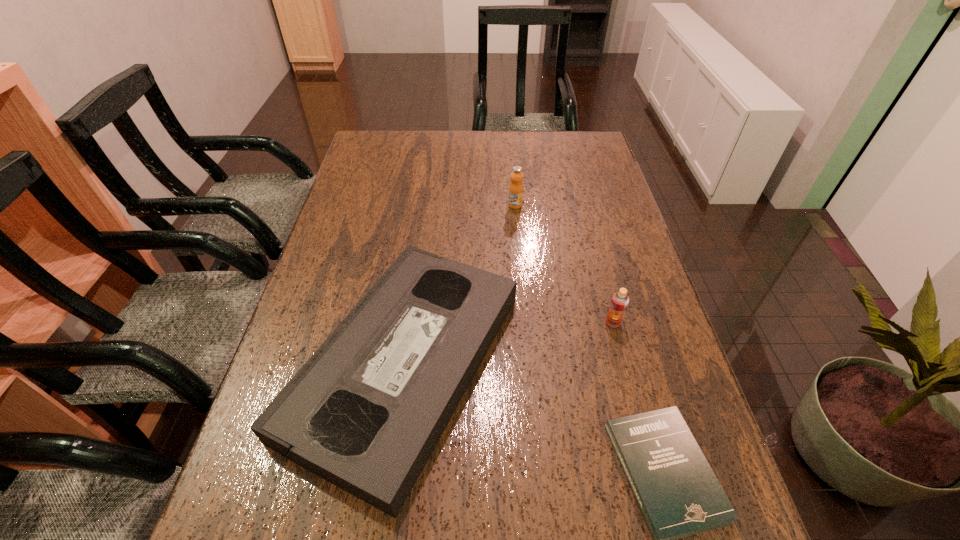
Image resolution: width=960 pixels, height=540 pixels. Find the location of `free space at the far edge`. free space at the far edge is located at coordinates (443, 152).

The height and width of the screenshot is (540, 960). What are the coordinates of `free space at the left edge of the desktop` in the screenshot? It's located at (258, 520).

The image size is (960, 540). I want to click on vacant region at the right edge of the desktop, so click(x=602, y=350).

The image size is (960, 540). Identify the location of vacant space at the far left corner of the desktop. (367, 140).

You are a GUI agent. You are given a task and a screenshot of the screen. Output one action in this format:
    pyautogui.click(x=<x>, y=<y>)
    Task: Click on the vacant point located between the videotape and the nearer orange juice
    
    Given the screenshot: What is the action you would take?
    pyautogui.click(x=509, y=343)

The image size is (960, 540). I want to click on unoccupied area between the right orange juice and the left orange juice, so [x=564, y=264].

Where is `free space between the right orange juice and the second shortest object`? free space between the right orange juice and the second shortest object is located at coordinates (509, 343).

You are a GUI agent. You are given a task and a screenshot of the screen. Output one action in this format:
    pyautogui.click(x=<x>, y=<y>)
    Task: Click on the third closest object relative to the shortest object
    
    Given the screenshot: What is the action you would take?
    pyautogui.click(x=516, y=187)

The width and height of the screenshot is (960, 540). Identify the location of object that ranks as the third closest to the shortest object. (516, 187).

The image size is (960, 540). Find the location of `free space that satisfies the following two spatial constraints: 1. on the front label of the left orange juice; 2. on the left side of the right orange juice`. free space that satisfies the following two spatial constraints: 1. on the front label of the left orange juice; 2. on the left side of the right orange juice is located at coordinates (526, 323).